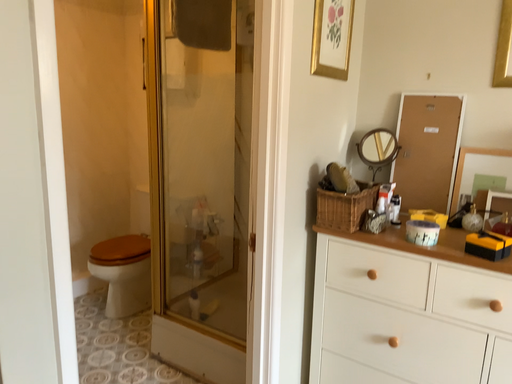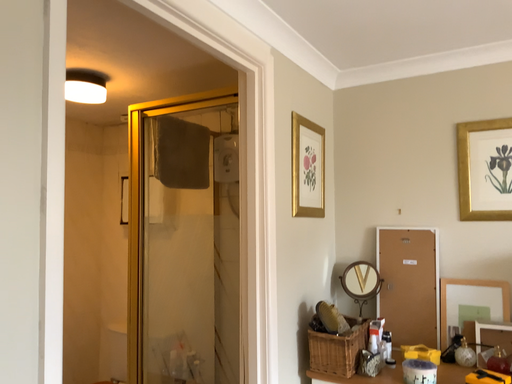
Question: How did the camera likely rotate when shooting the video?

Choices:
 (A) rotated downward
 (B) rotated upward

Answer: (B)